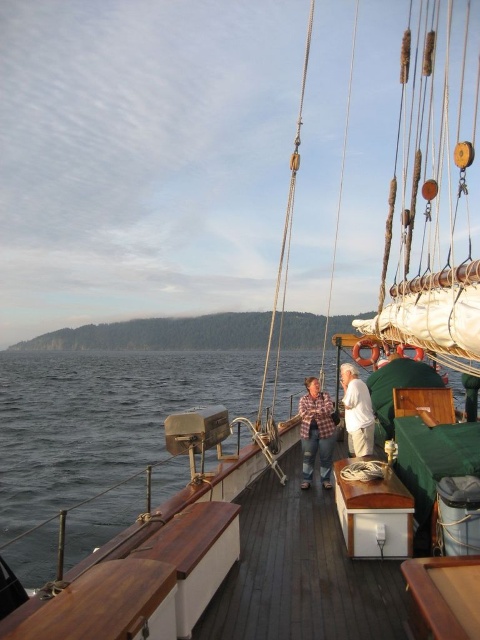
Question: Among these points, which one is farthest from the camera?

Choices:
 (A) (84, 467)
 (B) (371, 440)
 (C) (325, 400)
 (D) (302, 481)

Answer: (A)

Question: Where is plaid fabric shirt at center located in relation to white cotton shirt at center in the image?

Choices:
 (A) above
 (B) below

Answer: (B)

Question: Can you confirm if dark blue water at lower left is smaller than plaid fabric shirt at center?

Choices:
 (A) yes
 (B) no

Answer: (B)

Question: Which of the following is the closest to the observer?

Choices:
 (A) (359, 392)
 (B) (91, 525)

Answer: (A)

Question: Which point is farther from the camera taking this photo?

Choices:
 (A) (319, 400)
 (B) (321, 474)
 (C) (358, 436)
 (D) (457, 392)

Answer: (D)

Question: Does dark blue water at lower left have a smaller size compared to plaid fabric shirt at center?

Choices:
 (A) no
 (B) yes

Answer: (A)